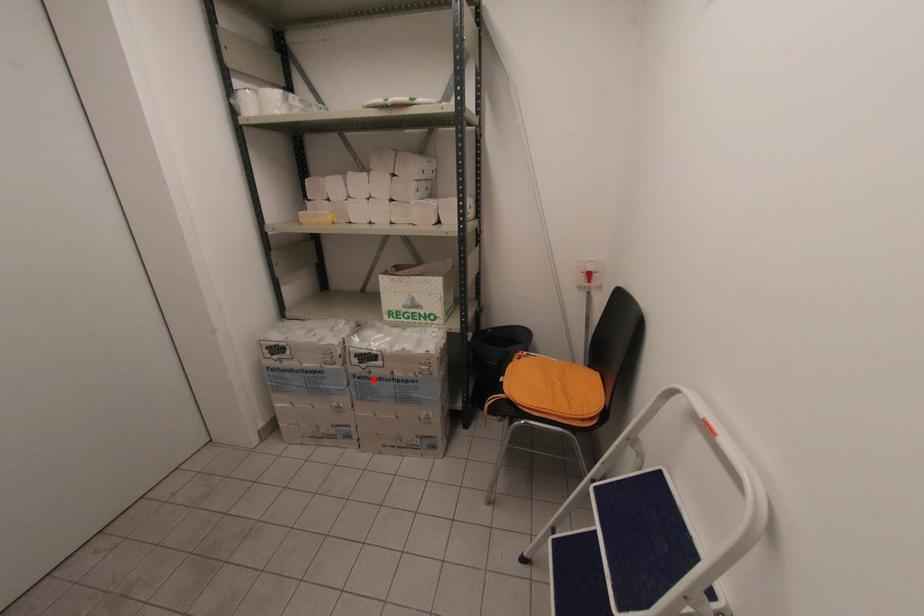
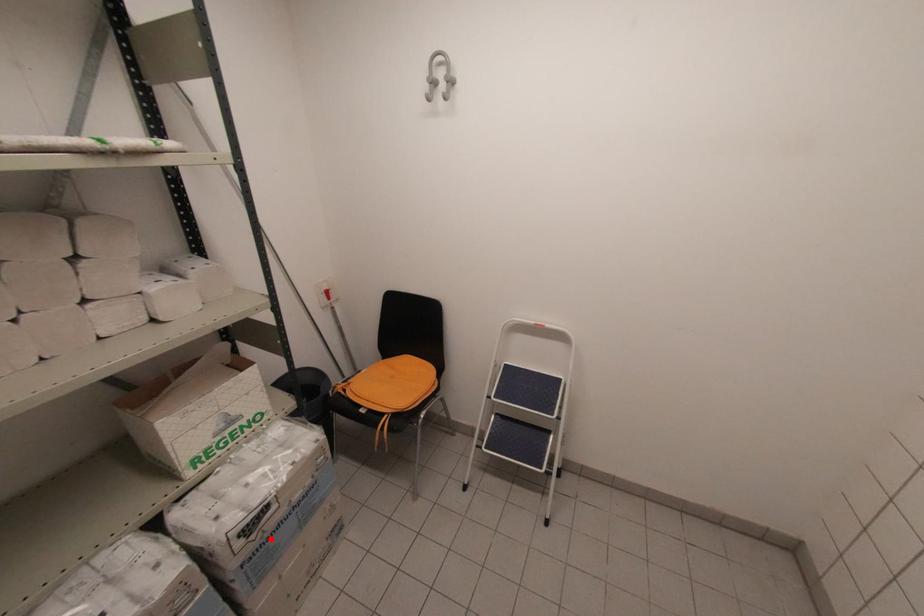
I am providing you with two images of the same scene from different viewpoints. A red point is marked on the first image and another point is marked on the second image. Is the marked point in image1 the same physical position as the marked point in image2?

Yes